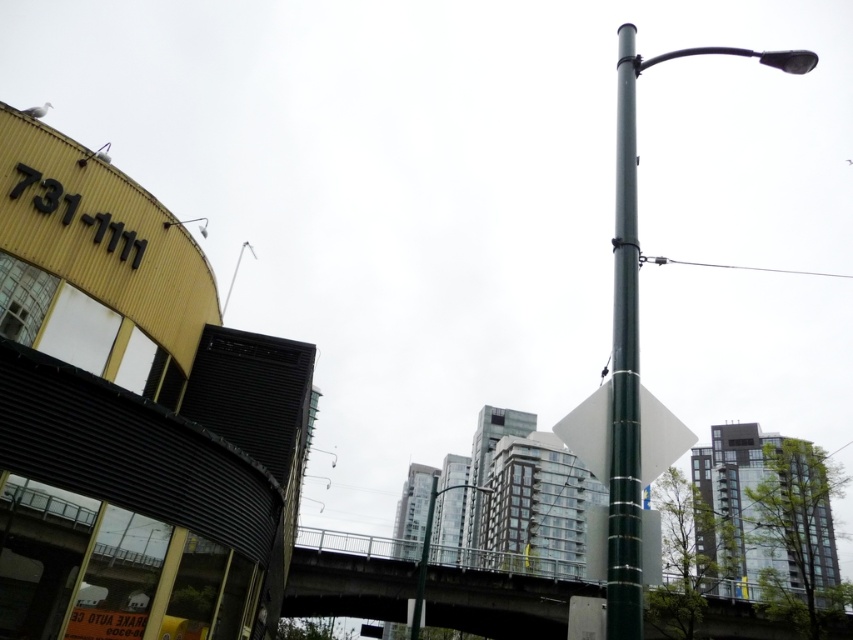
You are a city planner analyzing this urban scene. You need to place a new bench exactly at the midpoint between the curved building with yellow facade and the metallic pole at center. What are the coordinates of this midpoint?

The coordinates of the midpoint between the curved building with yellow facade and the metallic pole at center are not provided in the scene description. The description only specifies the location of the metallic pole at center as point (428, 552). Without the coordinates of the curved building with yellow facade, the midpoint cannot be calculated.

You are standing at the point with coordinates (x=236, y=273) in the urban scene. What object is exactly at your current position?

The silver metallic street light at upper center is located at point (x=236, y=273), so the object at your current position is the silver metallic street light at upper center.